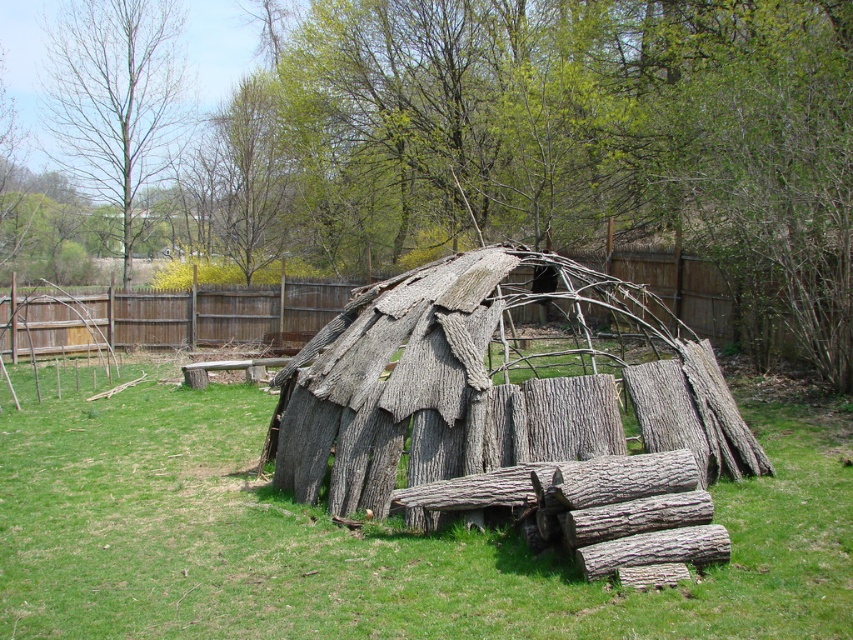
Question: Is the position of wooden fence at upper center more distant than that of bare wood tree at upper left?

Choices:
 (A) yes
 (B) no

Answer: (B)

Question: Among these objects, which one is nearest to the camera?

Choices:
 (A) wooden fence at upper center
 (B) gray bark hut at center

Answer: (B)

Question: Which point appears farthest from the camera in this image?

Choices:
 (A) (553, 595)
 (B) (354, 298)
 (C) (688, 83)

Answer: (B)

Question: Considering the relative positions of natural bark tree at center and gray bark hut at center in the image provided, where is natural bark tree at center located with respect to gray bark hut at center?

Choices:
 (A) left
 (B) right

Answer: (A)

Question: Observing the image, what is the correct spatial positioning of gray bark hut at center in reference to wooden fence at upper center?

Choices:
 (A) left
 (B) right

Answer: (B)

Question: Estimate the real-world distances between objects in this image. Which object is farther from the wooden fence at upper center?

Choices:
 (A) gray bark hut at center
 (B) bare wood tree at upper left
 (C) natural bark tree at center
 (D) green grass at center

Answer: (B)